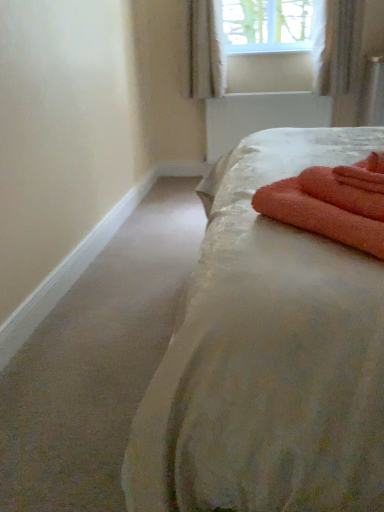
At what (x,y) coordinates should I click in order to perform the action: click on silky white bed at center. Please return your answer as a coordinate pair (x, y). Image resolution: width=384 pixels, height=512 pixels. Looking at the image, I should click on (268, 355).

Find the location of a particular element. white textured curtain at upper right, which is the 1th curtain in right-to-left order is located at coordinates (345, 52).

Image resolution: width=384 pixels, height=512 pixels. Identify the location of white sheer curtain at upper center, the first curtain positioned from the left. (206, 49).

Find the location of a particular element. This screenshot has width=384, height=512. silky white bed at center is located at coordinates (268, 355).

Between silky white bed at center and white textured curtain at upper right, which appears as the second curtain when viewed from the left, which one has more height?

Standing taller between the two is silky white bed at center.

Which is farther, (256, 302) or (319, 51)?

The point (319, 51) is more distant.

Who is bigger, silky white bed at center or white textured curtain at upper right, which appears as the second curtain when viewed from the left?

Bigger between the two is silky white bed at center.

Which object is closer to the camera, white textured curtain at upper right, which appears as the second curtain when viewed from the left, or white sheer curtain at upper center, the first curtain positioned from the left?

white textured curtain at upper right, which appears as the second curtain when viewed from the left, is more forward.

Identify the location of curtain lying above the white textured curtain at upper right, which appears as the second curtain when viewed from the left (from the image's perspective). (206, 49).

From the image's perspective, between white textured curtain at upper right, which appears as the second curtain when viewed from the left, and white sheer curtain at upper center, the first curtain positioned from the left, which one is located above?

From the image's view, white sheer curtain at upper center, the first curtain positioned from the left, is above.

Would you say white sheer curtain at upper center, the first curtain positioned from the left, is inside or outside silky white bed at center?

white sheer curtain at upper center, the first curtain positioned from the left, is outside silky white bed at center.

Is white sheer curtain at upper center, acting as the 2th curtain starting from the right, closer to camera compared to silky white bed at center?

No.

Is white sheer curtain at upper center, acting as the 2th curtain starting from the right, smaller than silky white bed at center?

Correct, white sheer curtain at upper center, acting as the 2th curtain starting from the right, occupies less space than silky white bed at center.

Image resolution: width=384 pixels, height=512 pixels. In order to click on bed below the white sheer curtain at upper center, acting as the 2th curtain starting from the right (from a real-world perspective) in this screenshot , I will do `click(268, 355)`.

Is orange terry cloth bath towel at right with white sheer curtain at upper center, the first curtain positioned from the left?

orange terry cloth bath towel at right is not next to white sheer curtain at upper center, the first curtain positioned from the left, and they're not touching.

Can you confirm if orange terry cloth bath towel at right is smaller than white sheer curtain at upper center, the first curtain positioned from the left?

Yes, orange terry cloth bath towel at right is smaller than white sheer curtain at upper center, the first curtain positioned from the left.

Is orange terry cloth bath towel at right further to the viewer compared to white sheer curtain at upper center, the first curtain positioned from the left?

No, it is not.

From their relative heights in the image, would you say white sheer curtain at upper center, the first curtain positioned from the left, is taller or shorter than white textured curtain at upper right, which is the 1th curtain in right-to-left order?

Considering their sizes, white sheer curtain at upper center, the first curtain positioned from the left, has more height than white textured curtain at upper right, which is the 1th curtain in right-to-left order.

From the picture: Does white sheer curtain at upper center, the first curtain positioned from the left, turn towards white textured curtain at upper right, which is the 1th curtain in right-to-left order?

No, white sheer curtain at upper center, the first curtain positioned from the left, is not oriented towards white textured curtain at upper right, which is the 1th curtain in right-to-left order.

From the picture: From the image's perspective, is white sheer curtain at upper center, the first curtain positioned from the left, above or below white textured curtain at upper right, which is the 1th curtain in right-to-left order?

Based on their image positions, white sheer curtain at upper center, the first curtain positioned from the left, is located above white textured curtain at upper right, which is the 1th curtain in right-to-left order.

Which object is closer to the camera, white sheer curtain at upper center, acting as the 2th curtain starting from the right, or white textured curtain at upper right, which appears as the second curtain when viewed from the left?

white textured curtain at upper right, which appears as the second curtain when viewed from the left, is in front.

From the image's perspective, which is below, orange terry cloth bath towel at right or white textured curtain at upper right, which is the 1th curtain in right-to-left order?

orange terry cloth bath towel at right is shown below in the image.

Who is bigger, orange terry cloth bath towel at right or white textured curtain at upper right, which is the 1th curtain in right-to-left order?

With larger size is white textured curtain at upper right, which is the 1th curtain in right-to-left order.

Considering the positions of objects orange terry cloth bath towel at right and white textured curtain at upper right, which is the 1th curtain in right-to-left order, in the image provided, who is behind, orange terry cloth bath towel at right or white textured curtain at upper right, which is the 1th curtain in right-to-left order,?

white textured curtain at upper right, which is the 1th curtain in right-to-left order, is behind.

How different are the orientations of orange terry cloth bath towel at right and white textured curtain at upper right, which is the 1th curtain in right-to-left order, in degrees?

orange terry cloth bath towel at right and white textured curtain at upper right, which is the 1th curtain in right-to-left order, are facing 135 degrees away from each other.

Does silky white bed at center come in front of orange terry cloth bath towel at right?

Yes, silky white bed at center is closer to the viewer.

Is point (284, 245) positioned behind point (351, 201)?

No, it is in front of (351, 201).

The height and width of the screenshot is (512, 384). Identify the location of bath towel below the silky white bed at center (from the image's perspective). (332, 203).

Find the location of a particular element. The height and width of the screenshot is (512, 384). curtain lying on the right of silky white bed at center is located at coordinates point(345,52).

Find the location of a particular element. curtain below the white sheer curtain at upper center, the first curtain positioned from the left (from the image's perspective) is located at coordinates (x=345, y=52).

Looking at the image, which one is located further to white sheer curtain at upper center, acting as the 2th curtain starting from the right, silky white bed at center or white textured curtain at upper right, which appears as the second curtain when viewed from the left?

Based on the image, silky white bed at center appears to be further to white sheer curtain at upper center, acting as the 2th curtain starting from the right.

In the scene shown: Which object lies nearer to the anchor point orange terry cloth bath towel at right, silky white bed at center or white sheer curtain at upper center, acting as the 2th curtain starting from the right?

Based on the image, silky white bed at center appears to be nearer to orange terry cloth bath towel at right.

Which object lies nearer to the anchor point silky white bed at center, white sheer curtain at upper center, the first curtain positioned from the left, or orange terry cloth bath towel at right?

orange terry cloth bath towel at right lies closer to silky white bed at center than the other object.

Considering their positions, is white textured curtain at upper right, which appears as the second curtain when viewed from the left, positioned further to silky white bed at center than white sheer curtain at upper center, the first curtain positioned from the left?

white sheer curtain at upper center, the first curtain positioned from the left, is positioned further to the anchor silky white bed at center.

Which object lies nearer to the anchor point silky white bed at center, orange terry cloth bath towel at right or white sheer curtain at upper center, acting as the 2th curtain starting from the right?

orange terry cloth bath towel at right is positioned closer to the anchor silky white bed at center.

From the image, which object appears to be nearer to orange terry cloth bath towel at right, white textured curtain at upper right, which appears as the second curtain when viewed from the left, or silky white bed at center?

silky white bed at center.

Which object lies nearer to the anchor point white sheer curtain at upper center, the first curtain positioned from the left, orange terry cloth bath towel at right or white textured curtain at upper right, which appears as the second curtain when viewed from the left?

white textured curtain at upper right, which appears as the second curtain when viewed from the left, is closer to white sheer curtain at upper center, the first curtain positioned from the left.

Based on their spatial positions, is white sheer curtain at upper center, the first curtain positioned from the left, or white textured curtain at upper right, which is the 1th curtain in right-to-left order, closer to silky white bed at center?

white textured curtain at upper right, which is the 1th curtain in right-to-left order, is positioned closer to the anchor silky white bed at center.

This screenshot has height=512, width=384. Find the location of `bath towel between silky white bed at center and white sheer curtain at upper center, the first curtain positioned from the left, from front to back`. bath towel between silky white bed at center and white sheer curtain at upper center, the first curtain positioned from the left, from front to back is located at coordinates [x=332, y=203].

You are a GUI agent. You are given a task and a screenshot of the screen. Output one action in this format:
    pyautogui.click(x=<x>, y=<y>)
    Task: Click on the bath towel between silky white bed at center and white textured curtain at upper right, which appears as the second curtain when viewed from the left, along the z-axis
    Image resolution: width=384 pixels, height=512 pixels.
    Given the screenshot: What is the action you would take?
    pyautogui.click(x=332, y=203)

Locate an element on the screen. Image resolution: width=384 pixels, height=512 pixels. curtain between orange terry cloth bath towel at right and white sheer curtain at upper center, the first curtain positioned from the left, along the z-axis is located at coordinates (345, 52).

Locate an element on the screen. The width and height of the screenshot is (384, 512). curtain between silky white bed at center and white sheer curtain at upper center, the first curtain positioned from the left, in the front-back direction is located at coordinates [345, 52].